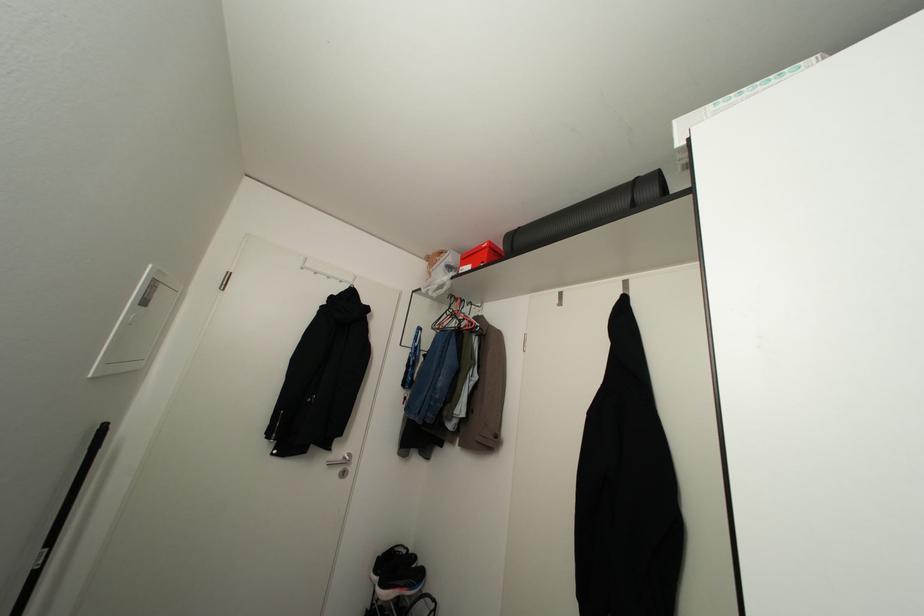
At what (x,y) coordinates should I click in order to perform the action: click on metal door handle. Please return your answer as a coordinate pair (x, y). This screenshot has height=616, width=924. Looking at the image, I should click on (338, 468).